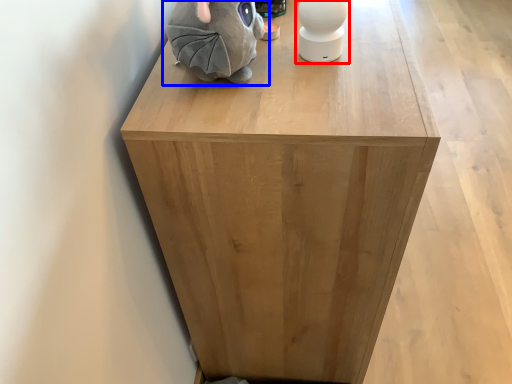
Question: Which point is further to the camera, toy (highlighted by a red box) or toy (highlighted by a blue box)?

Choices:
 (A) toy
 (B) toy

Answer: (A)